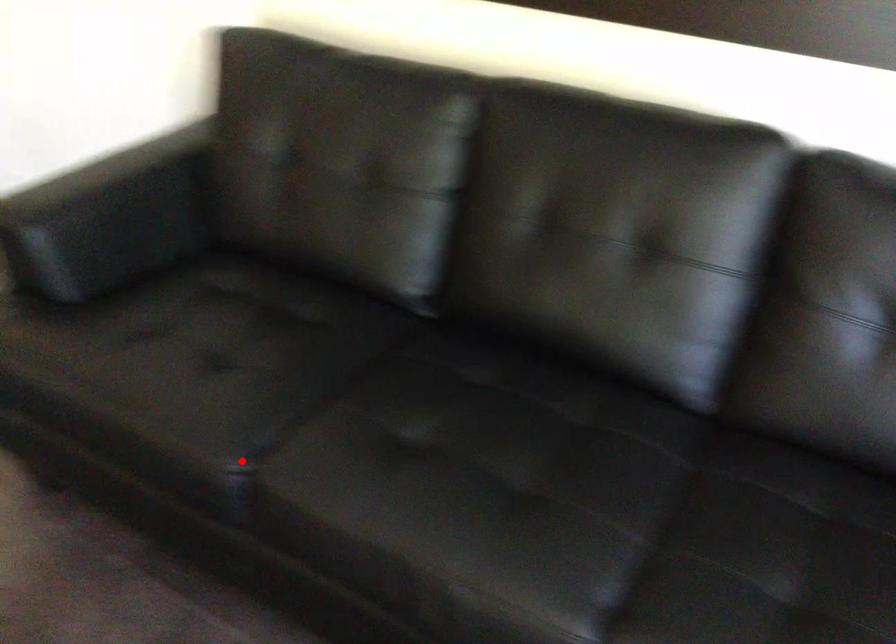
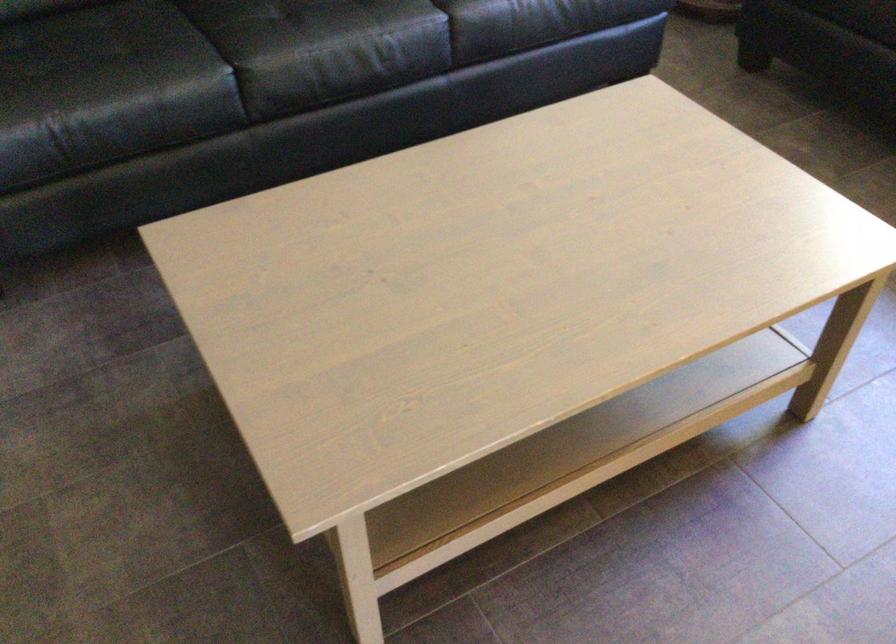
Locate, in the second image, the point that corresponds to the highlighted location in the first image.

(221, 78)